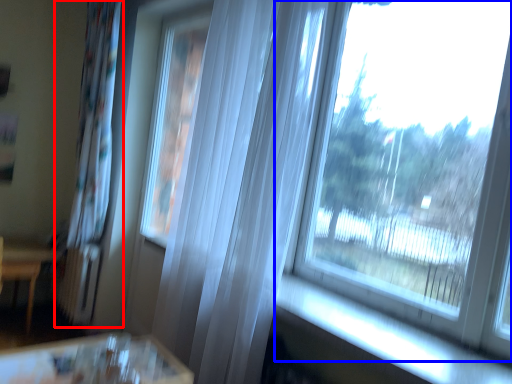
Question: Which object is further to the camera taking this photo, curtain (highlighted by a red box) or window (highlighted by a blue box)?

Choices:
 (A) curtain
 (B) window

Answer: (A)